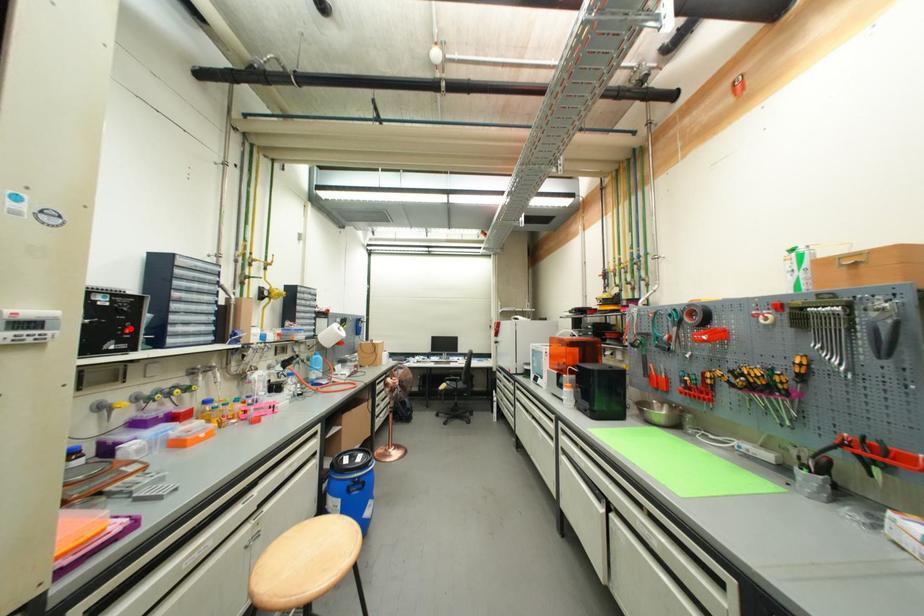
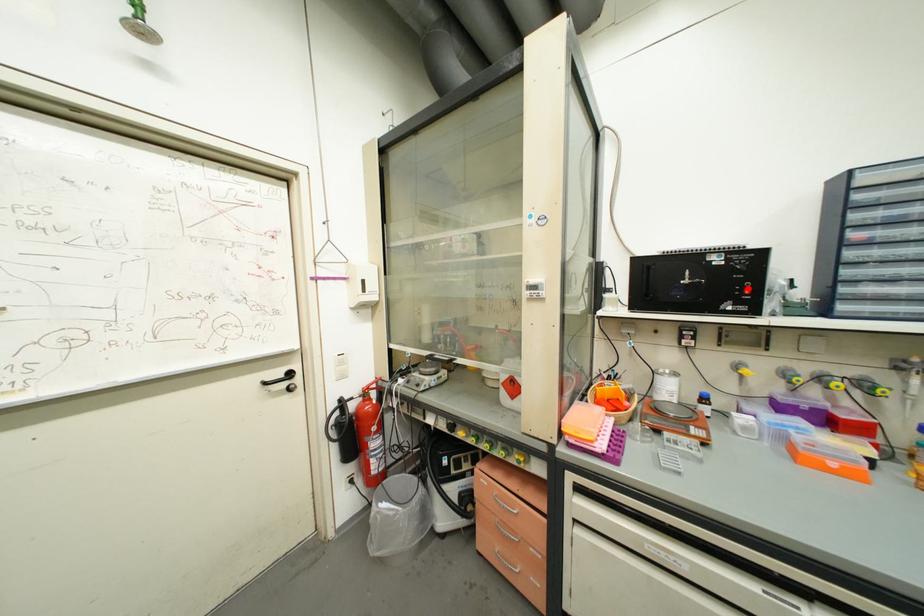
I am providing you with two images of the same scene from different viewpoints. A red point is marked on the first image and another point is marked on the second image. Do the highlighted points in image1 and image2 indicate the same real-world spot?

Yes